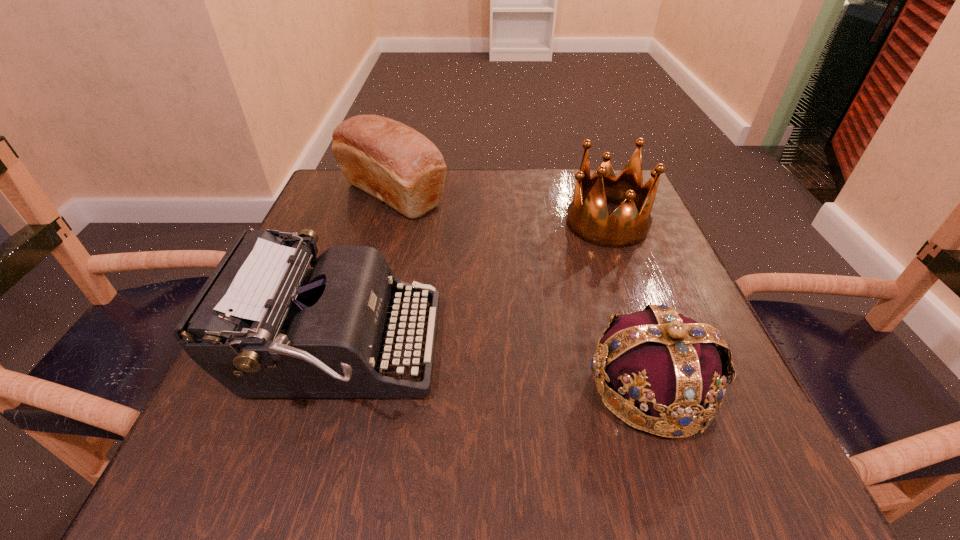
The image size is (960, 540). Find the location of `empty location between the bread and the farther crown`. empty location between the bread and the farther crown is located at coordinates (500, 209).

I want to click on vacant area that lies between the bread and the shorter crown, so click(x=522, y=291).

The height and width of the screenshot is (540, 960). Find the location of `vacant area that lies between the farther crown and the typewriter`. vacant area that lies between the farther crown and the typewriter is located at coordinates (472, 287).

This screenshot has width=960, height=540. Identify the location of free space between the typewriter and the farther crown. (472, 287).

Locate which object ranks third in proximity to the bread. Please provide its 2D coordinates. Your answer should be formatted as a tuple, i.e. [(x, y)], where the tuple contains the x and y coordinates of a point satisfying the conditions above.

[(670, 365)]

Find the location of a particular element. object that ranks as the third closest to the typewriter is located at coordinates (588, 218).

Find the location of `free location that satisfies the following two spatial constraints: 1. on the front-facing side of the typewriter; 2. on the left side of the nearer crown`. free location that satisfies the following two spatial constraints: 1. on the front-facing side of the typewriter; 2. on the left side of the nearer crown is located at coordinates (327, 386).

Locate an element on the screen. This screenshot has width=960, height=540. free region that satisfies the following two spatial constraints: 1. on the back side of the nearer crown; 2. on the left side of the farther crown is located at coordinates point(596,223).

The height and width of the screenshot is (540, 960). In order to click on free space that satisfies the following two spatial constraints: 1. on the front side of the bread; 2. on the front-facing side of the typewriter in this screenshot , I will do `click(349, 350)`.

Identify the location of vacant point that satisfies the following two spatial constraints: 1. on the front-facing side of the nearer crown; 2. on the left side of the typewriter. (327, 386).